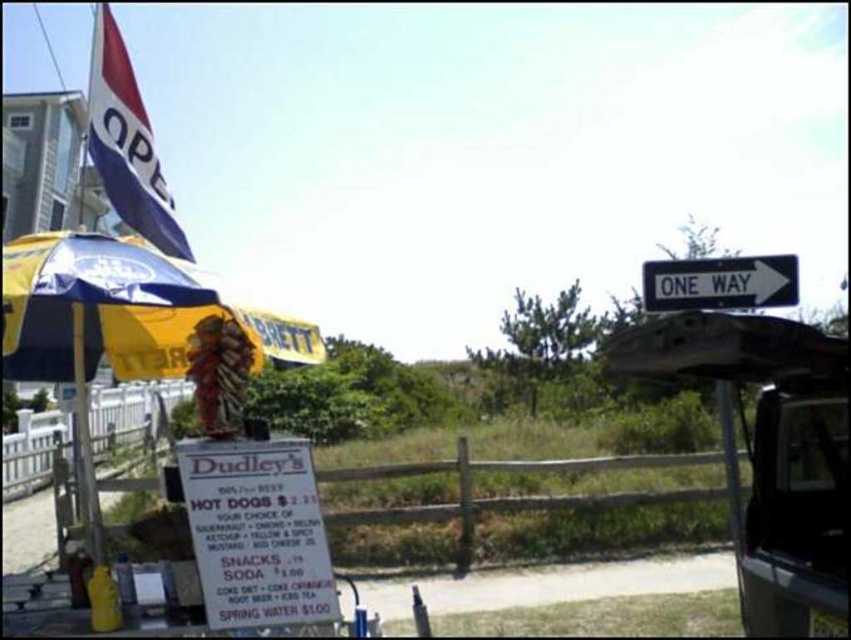
Question: Which object appears closest to the camera in this image?

Choices:
 (A) blue and white striped flag at upper left
 (B) yellow/blue fabric umbrella at left
 (C) white plastic street sign at upper right
 (D) yellow matte pole at left

Answer: (B)

Question: Considering the relative positions of yellow/blue fabric umbrella at left and yellow matte pole at left in the image provided, where is yellow/blue fabric umbrella at left located with respect to yellow matte pole at left?

Choices:
 (A) left
 (B) right

Answer: (B)

Question: Which of the following is the closest to the observer?

Choices:
 (A) yellow/blue fabric umbrella at left
 (B) wooden signboard at lower center
 (C) yellow matte pole at left
 (D) white plastic street sign at upper right

Answer: (B)

Question: Is yellow/blue fabric umbrella at left to the right of white plastic street sign at upper right from the viewer's perspective?

Choices:
 (A) yes
 (B) no

Answer: (B)

Question: Is yellow/blue fabric umbrella at left below yellow matte pole at left?

Choices:
 (A) no
 (B) yes

Answer: (A)

Question: Which point is farther to the camera?

Choices:
 (A) (647, 262)
 (B) (300, 508)

Answer: (A)